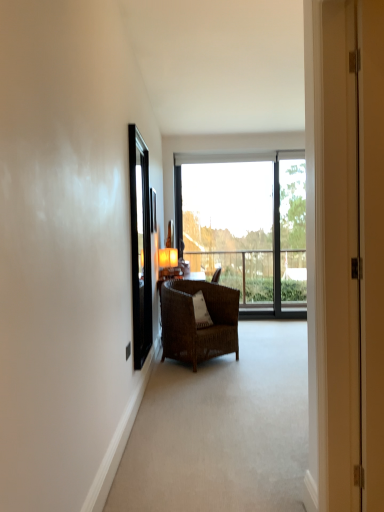
Question: Does matte white door at center have a smaller size compared to matte orange lampshade at center?

Choices:
 (A) no
 (B) yes

Answer: (A)

Question: Is matte white door at center touching matte orange lampshade at center?

Choices:
 (A) yes
 (B) no

Answer: (B)

Question: From a real-world perspective, is matte white door at center on matte orange lampshade at center?

Choices:
 (A) no
 (B) yes

Answer: (B)

Question: Can you confirm if matte white door at center is taller than matte orange lampshade at center?

Choices:
 (A) yes
 (B) no

Answer: (A)

Question: From a real-world perspective, is matte white door at center beneath matte orange lampshade at center?

Choices:
 (A) no
 (B) yes

Answer: (A)

Question: From their relative heights in the image, would you say matte orange lampshade at center is taller or shorter than black glossy screen door at left?

Choices:
 (A) short
 (B) tall

Answer: (A)

Question: From the image's perspective, is matte orange lampshade at center located above or below black glossy screen door at left?

Choices:
 (A) below
 (B) above

Answer: (A)

Question: In the image, is matte orange lampshade at center positioned in front of or behind black glossy screen door at left?

Choices:
 (A) behind
 (B) front

Answer: (A)

Question: From a real-world perspective, is matte orange lampshade at center above or below black glossy screen door at left?

Choices:
 (A) above
 (B) below

Answer: (B)

Question: In terms of size, does transparent glass window at center appear bigger or smaller than matte white door at center?

Choices:
 (A) big
 (B) small

Answer: (A)

Question: Is transparent glass window at center spatially inside matte white door at center, or outside of it?

Choices:
 (A) inside
 (B) outside

Answer: (B)

Question: From a real-world perspective, is transparent glass window at center above or below matte white door at center?

Choices:
 (A) above
 (B) below

Answer: (A)

Question: Is point (233, 219) positioned closer to the camera than point (339, 40)?

Choices:
 (A) closer
 (B) farther

Answer: (B)

Question: Looking at their shapes, would you say transparent glass window at center is wider or thinner than matte orange lampshade at center?

Choices:
 (A) wide
 (B) thin

Answer: (B)

Question: Which is correct: transparent glass window at center is inside matte orange lampshade at center, or outside of it?

Choices:
 (A) inside
 (B) outside

Answer: (B)